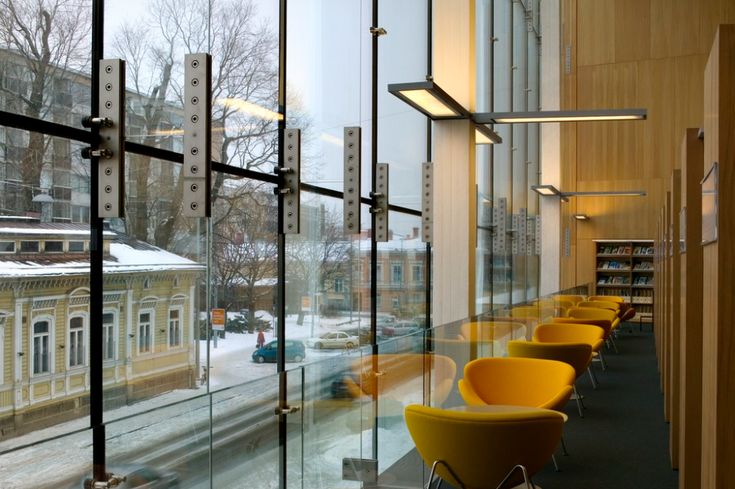
The image size is (735, 489). I want to click on chair, so (459, 442), (501, 385), (545, 351), (577, 318), (569, 328), (595, 313), (600, 304), (619, 301).